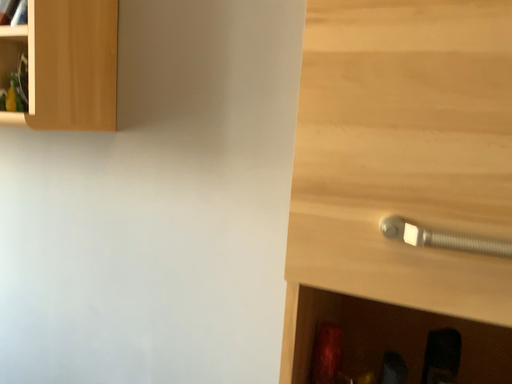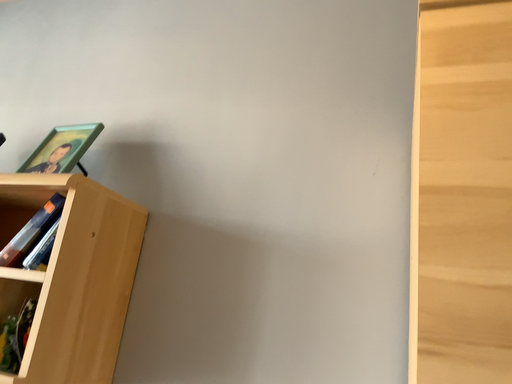
Question: Which way did the camera rotate in the video?

Choices:
 (A) rotated downward
 (B) rotated upward

Answer: (B)